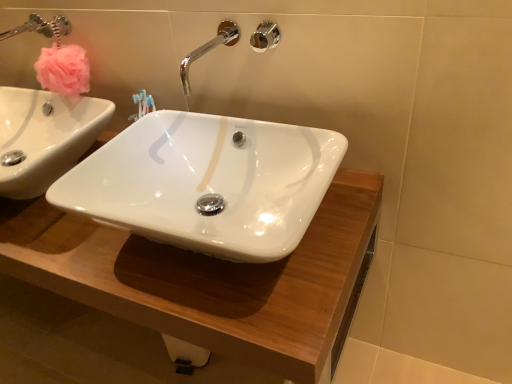
Consider the image. What is the approximate width of polished chrome shower at upper center?

polished chrome shower at upper center is 3.85 centimeters in width.

This screenshot has height=384, width=512. What do you see at coordinates (209, 49) in the screenshot? I see `chrome/metallic faucet at upper center` at bounding box center [209, 49].

Identify the location of white glossy wood counter top at center. This screenshot has width=512, height=384. (x=207, y=278).

Locate an element on the screen. Image resolution: width=512 pixels, height=384 pixels. polished chrome shower at upper center is located at coordinates (265, 36).

How distant is chrome/metallic faucet at upper center from white glossy wood counter top at center?

chrome/metallic faucet at upper center and white glossy wood counter top at center are 21.65 inches apart from each other.

Is white glossy wood counter top at center a part of chrome/metallic faucet at upper center?

Actually, white glossy wood counter top at center is outside chrome/metallic faucet at upper center.

Is point (190, 56) behind point (72, 238)?

That is True.

Considering the sizes of objects chrome/metallic faucet at upper center and white glossy wood counter top at center in the image provided, who is shorter, chrome/metallic faucet at upper center or white glossy wood counter top at center?

chrome/metallic faucet at upper center.

The width and height of the screenshot is (512, 384). I want to click on shower that appears on the right of chrome/metallic faucet at upper center, so click(265, 36).

Based on the photo, from a real-world perspective, is polished chrome shower at upper center physically located above or below chrome/metallic faucet at upper center?

From a real-world perspective, polished chrome shower at upper center is physically above chrome/metallic faucet at upper center.

Is polished chrome shower at upper center inside or outside of chrome/metallic faucet at upper center?

polished chrome shower at upper center exists outside the volume of chrome/metallic faucet at upper center.

Which object is further away from the camera taking this photo, chrome/metallic faucet at upper center or polished chrome shower at upper center?

polished chrome shower at upper center is further from the camera.

I want to click on tap lying on the left of polished chrome shower at upper center, so click(209, 49).

From the picture: Considering the relative sizes of chrome/metallic faucet at upper center and polished chrome shower at upper center in the image provided, is chrome/metallic faucet at upper center thinner than polished chrome shower at upper center?

No, chrome/metallic faucet at upper center is not thinner than polished chrome shower at upper center.

From a real-world perspective, relative to polished chrome shower at upper center, is chrome/metallic faucet at upper center vertically above or below?

chrome/metallic faucet at upper center is situated lower than polished chrome shower at upper center in the real world.

Between polished chrome shower at upper center and white glossy wood counter top at center, which one has more height?

Standing taller between the two is white glossy wood counter top at center.

Can you tell me how much polished chrome shower at upper center and white glossy wood counter top at center differ in facing direction?

They differ by 0.0127 degrees in their facing directions.

Considering the sizes of objects polished chrome shower at upper center and white glossy wood counter top at center in the image provided, who is smaller, polished chrome shower at upper center or white glossy wood counter top at center?

polished chrome shower at upper center.

At what (x,y) coordinates should I click in order to perform the action: click on counter top lying on the left of polished chrome shower at upper center. Please return your answer as a coordinate pair (x, y). Image resolution: width=512 pixels, height=384 pixels. Looking at the image, I should click on (207, 278).

Can you tell me how much white glossy wood counter top at center and polished chrome shower at upper center differ in facing direction?

The facing directions of white glossy wood counter top at center and polished chrome shower at upper center are 0.0127 degrees apart.

Is white glossy wood counter top at center looking in the opposite direction of polished chrome shower at upper center?

No, white glossy wood counter top at center's orientation is not away from polished chrome shower at upper center.

Which is in front, point (125, 237) or point (260, 41)?

The point (260, 41) is closer.

Is the depth of white glossy wood counter top at center less than that of chrome/metallic faucet at upper center?

Result: Yes, it is.

Choose the correct answer: Is white glossy wood counter top at center inside chrome/metallic faucet at upper center or outside it?

white glossy wood counter top at center is not enclosed by chrome/metallic faucet at upper center.

Are white glossy wood counter top at center and chrome/metallic faucet at upper center making contact?

No, white glossy wood counter top at center is not next to chrome/metallic faucet at upper center.

Is white glossy wood counter top at center to the left of chrome/metallic faucet at upper center from the viewer's perspective?

Yes.

Find the location of a particular element. This screenshot has height=384, width=512. tap on the right of white glossy wood counter top at center is located at coordinates (209, 49).

This screenshot has width=512, height=384. I want to click on shower lying behind the chrome/metallic faucet at upper center, so click(x=265, y=36).

Looking at the image, which one is located further to white glossy wood counter top at center, chrome/metallic faucet at upper center or polished chrome shower at upper center?

Among the two, polished chrome shower at upper center is located further to white glossy wood counter top at center.

In the scene shown: From the image, which object appears to be farther from chrome/metallic faucet at upper center, polished chrome shower at upper center or white glossy wood counter top at center?

white glossy wood counter top at center lies further to chrome/metallic faucet at upper center than the other object.

Which object lies nearer to the anchor point white glossy wood counter top at center, polished chrome shower at upper center or chrome/metallic faucet at upper center?

chrome/metallic faucet at upper center is positioned closer to the anchor white glossy wood counter top at center.

From the picture: Considering their positions, is chrome/metallic faucet at upper center positioned closer to polished chrome shower at upper center than white glossy wood counter top at center?

chrome/metallic faucet at upper center is positioned closer to the anchor polished chrome shower at upper center.

From the image, which object appears to be nearer to chrome/metallic faucet at upper center, white glossy wood counter top at center or polished chrome shower at upper center?

Among the two, polished chrome shower at upper center is located nearer to chrome/metallic faucet at upper center.

Estimate the real-world distances between objects in this image. Which object is further from polished chrome shower at upper center, white glossy wood counter top at center or chrome/metallic faucet at upper center?

Based on the image, white glossy wood counter top at center appears to be further to polished chrome shower at upper center.

Identify the location of tap between white glossy wood counter top at center and polished chrome shower at upper center in the horizontal direction. (209, 49).